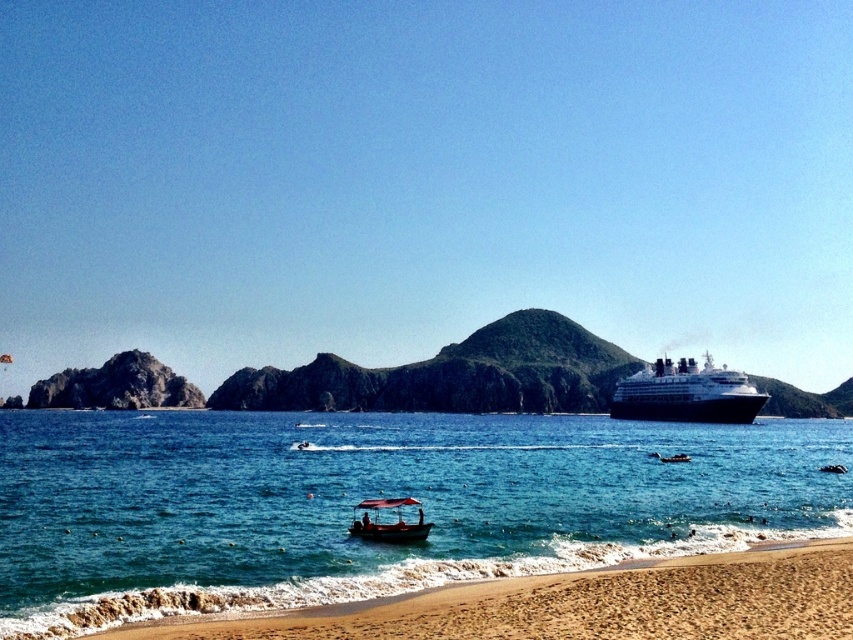
You are a sailor on the wooden boat at center and want to reach the black glossy cruise ship at right. The safety regulations state that your boat can only approach within 100 meters of another vessel. Can you safely approach the cruise ship from your current position?

The distance between the black glossy cruise ship at right and wooden boat at center is 97.50 meters, which is within the 100 meters safety regulation. Therefore, you can safely approach the cruise ship from your current position.

You are standing on the sandy beach at lower right and want to see the black glossy cruise ship at right. Which direction should you look to see the cruise ship?

You should look to the right because the black glossy cruise ship at right is taller than the sandy beach at lower right, making it visible from that direction.